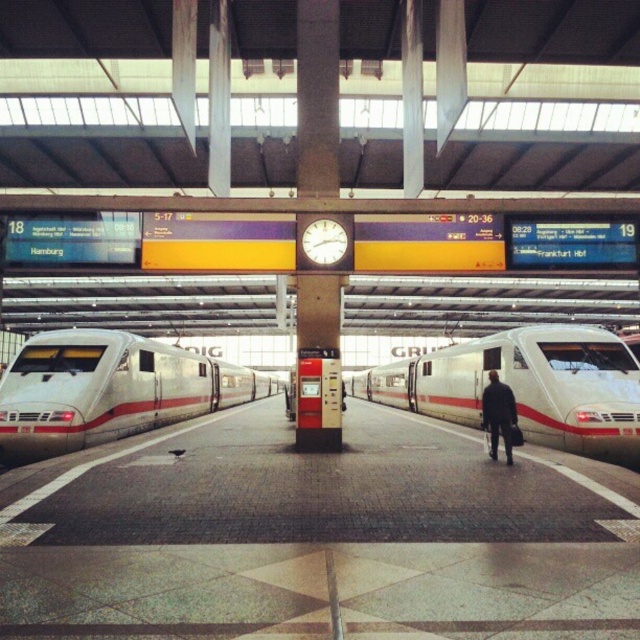
Based on the photo, you are a passenger waiting at the train station and need to board the white glossy train at center. There is a dark blue suit at center blocking your path. Can you walk around it without touching the train?

The white glossy train at center is taller than the dark blue suit at center, so you can walk around the dark blue suit at center without touching the train since the train is higher and provides enough space.

You are a station attendant who needs to park a new train that is 20 meters long. The station has a platform with limited space. You see the white glossy train at center and the silver metallic train at left. Which train should you move to accommodate the new train?

The white glossy train at center occupies less space than the silver metallic train at left, so you should move the white glossy train at center to make space for the new train.